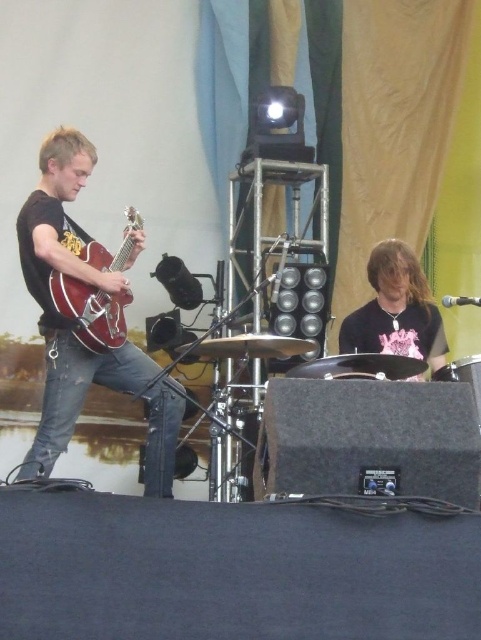
Can you confirm if matte black guitar at left is positioned to the right of glossy wood guitar at left?

Incorrect, matte black guitar at left is not on the right side of glossy wood guitar at left.

Does point (62, 408) come farther from viewer compared to point (99, 352)?

No, (62, 408) is in front of (99, 352).

Does point (102, 385) come behind point (78, 300)?

That is True.

The height and width of the screenshot is (640, 481). In order to click on matte black guitar at left in this screenshot , I will do `click(52, 305)`.

Does glossy wood guitar at left appear under black drum at center?

No.

This screenshot has width=481, height=640. I want to click on glossy wood guitar at left, so click(90, 310).

Between point (123, 339) and point (379, 371), which one is positioned behind?

Positioned behind is point (123, 339).

Locate an element on the screen. The height and width of the screenshot is (640, 481). glossy wood guitar at left is located at coordinates (90, 310).

Can you confirm if shiny black shirt at center is smaller than black drum at center?

No.

This screenshot has width=481, height=640. I want to click on shiny black shirt at center, so click(x=395, y=310).

Find the location of `shiny black shirt at center`. shiny black shirt at center is located at coordinates (395, 310).